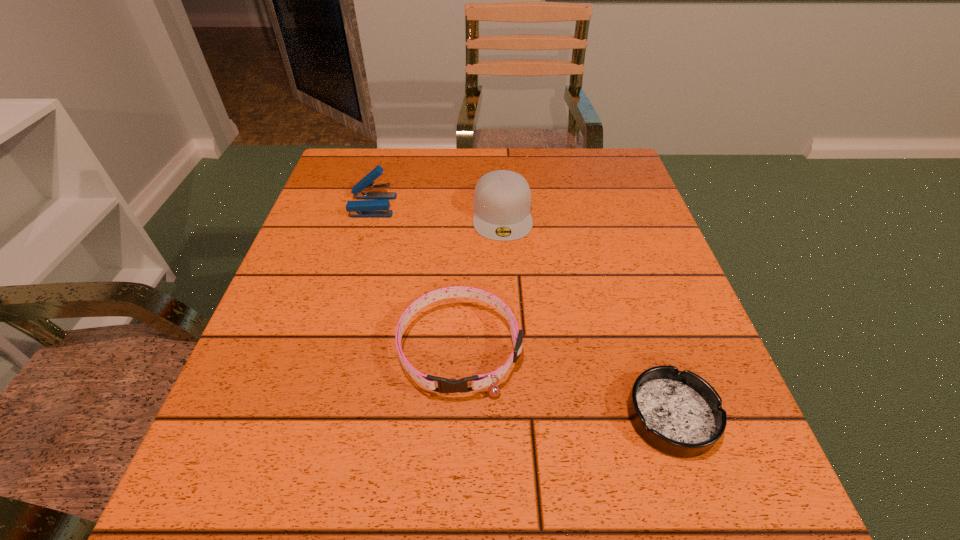
Identify the location of cap. The width and height of the screenshot is (960, 540). (502, 199).

You are a GUI agent. You are given a task and a screenshot of the screen. Output one action in this format:
    pyautogui.click(x=<x>, y=<y>)
    Task: Click on the leftmost object
    
    Given the screenshot: What is the action you would take?
    pyautogui.click(x=360, y=208)

In order to click on dog collar in this screenshot , I will do `click(479, 381)`.

Locate an element on the screen. the rightmost object is located at coordinates (679, 413).

Where is `the shortest object`? The image size is (960, 540). the shortest object is located at coordinates (679, 413).

Identify the location of free space located on the front-facing side of the cap. (511, 352).

This screenshot has width=960, height=540. Find the location of `vacant space situated on the back of the leftmost object`. vacant space situated on the back of the leftmost object is located at coordinates (382, 173).

Image resolution: width=960 pixels, height=540 pixels. What are the coordinates of `vacant region located 0.160m with the buckle on the dog collar` in the screenshot? It's located at (453, 508).

The width and height of the screenshot is (960, 540). What are the coordinates of `vacant space located 0.090m on the front of the shortest object` in the screenshot? It's located at (708, 528).

What are the coordinates of `cap located in the far edge section of the desktop` in the screenshot? It's located at (502, 199).